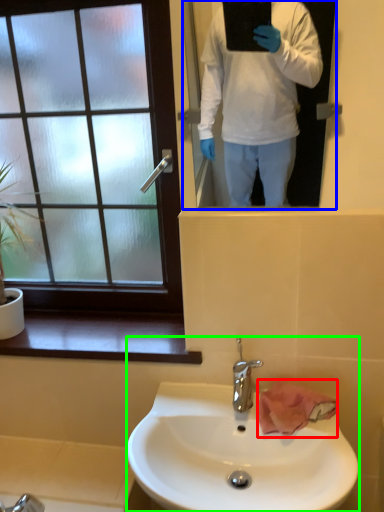
Question: Estimate the real-world distances between objects in this image. Which object is farther from hand towel (highlighted by a red box), mirror (highlighted by a blue box) or sink (highlighted by a green box)?

Choices:
 (A) mirror
 (B) sink

Answer: (A)